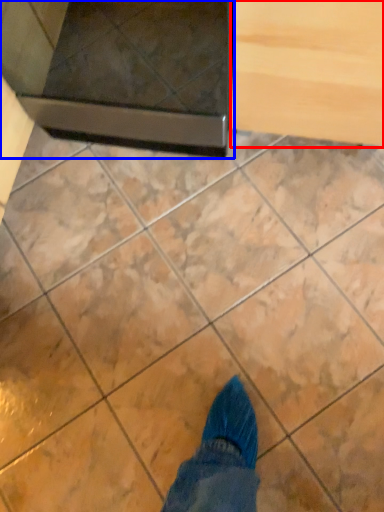
Question: Among these objects, which one is nearest to the camera, drawer (highlighted by a red box) or appliance (highlighted by a blue box)?

Choices:
 (A) drawer
 (B) appliance

Answer: (A)